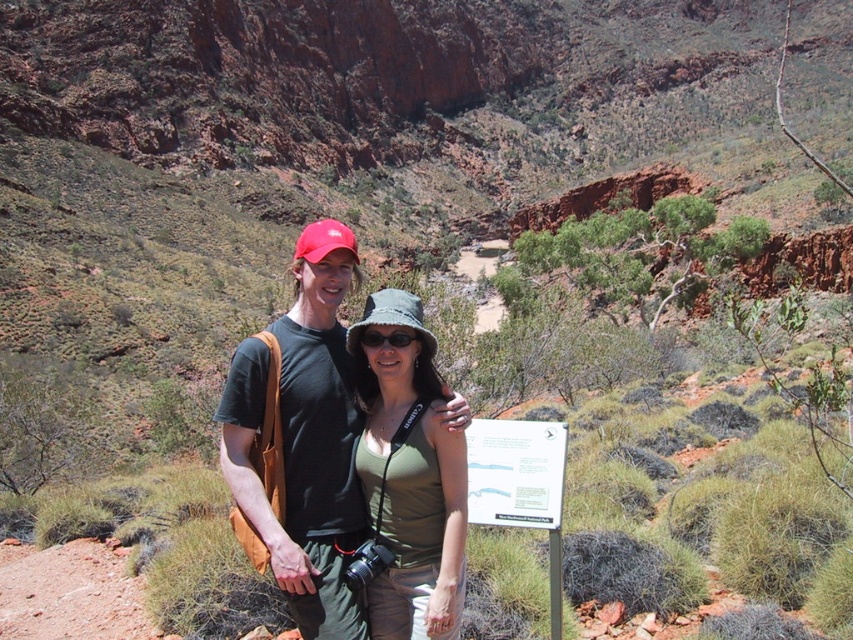
Can you confirm if green fabric hat at center is positioned to the right of black matte sunglasses at center?

Indeed, green fabric hat at center is positioned on the right side of black matte sunglasses at center.

Does green fabric hat at center have a lesser height compared to black matte sunglasses at center?

In fact, green fabric hat at center may be taller than black matte sunglasses at center.

What do you see at coordinates (409, 477) in the screenshot?
I see `green fabric hat at center` at bounding box center [409, 477].

This screenshot has height=640, width=853. What are the coordinates of `green fabric hat at center` in the screenshot? It's located at (409, 477).

Can you confirm if matte black shirt at center is positioned below black matte sunglasses at center?

Indeed, matte black shirt at center is positioned under black matte sunglasses at center.

Does matte black shirt at center appear over black matte sunglasses at center?

No.

Does point (274, 540) lie in front of point (366, 342)?

Yes, point (274, 540) is in front of point (366, 342).

Identify the location of matte black shirt at center. (300, 442).

Can you confirm if matte black shirt at center is positioned below green fabric hat at center?

No, matte black shirt at center is not below green fabric hat at center.

Is matte black shirt at center bigger than green fabric hat at center?

Yes, matte black shirt at center is bigger than green fabric hat at center.

What do you see at coordinates (300, 442) in the screenshot? The image size is (853, 640). I see `matte black shirt at center` at bounding box center [300, 442].

Where is `matte black shirt at center`? This screenshot has width=853, height=640. matte black shirt at center is located at coordinates (300, 442).